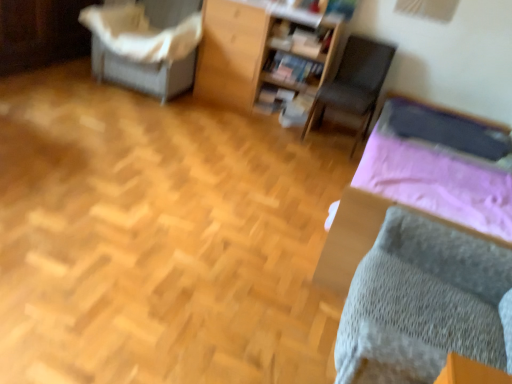
The image size is (512, 384). Identify the location of unoccupied area in front of wooden bookshelf at upper center, the 1th furniture from the right. (262, 133).